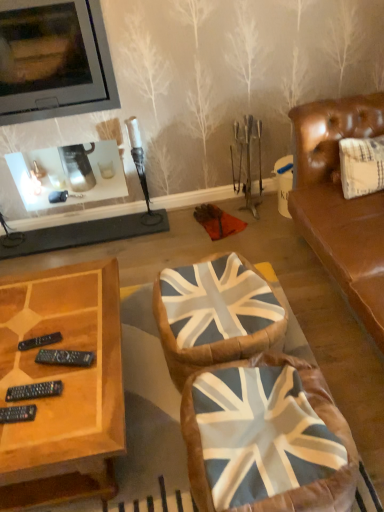
I want to click on free space above woodenwoodencoffee table at lower left (from a real-world perspective), so click(x=48, y=345).